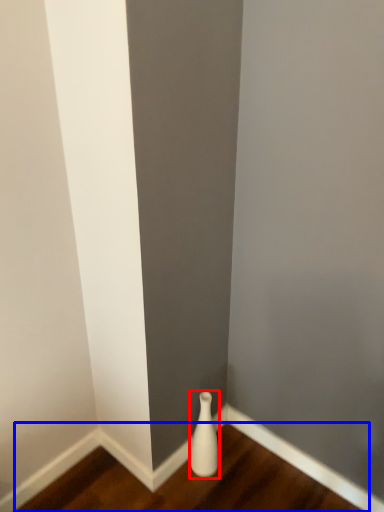
Question: Among these objects, which one is farthest to the camera, vase (highlighted by a red box) or hardwood (highlighted by a blue box)?

Choices:
 (A) vase
 (B) hardwood

Answer: (A)